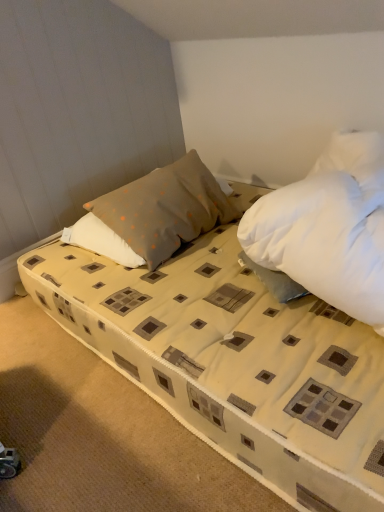
Question: Could gray dotted pillow at center be considered to be inside beige fabric bed at center?

Choices:
 (A) yes
 (B) no

Answer: (B)

Question: Is beige fabric bed at center smaller than gray dotted pillow at center?

Choices:
 (A) yes
 (B) no

Answer: (B)

Question: From the image's perspective, is beige fabric bed at center located beneath gray dotted pillow at center?

Choices:
 (A) yes
 (B) no

Answer: (A)

Question: Does beige fabric bed at center lie in front of gray dotted pillow at center?

Choices:
 (A) no
 (B) yes

Answer: (B)

Question: Does beige fabric bed at center have a lesser width compared to gray dotted pillow at center?

Choices:
 (A) yes
 (B) no

Answer: (B)

Question: Is beige fabric bed at center positioned beyond the bounds of gray dotted pillow at center?

Choices:
 (A) yes
 (B) no

Answer: (A)

Question: Can you confirm if gray dotted pillow at center is positioned to the right of beige fabric bed at center?

Choices:
 (A) no
 (B) yes

Answer: (A)

Question: Considering the relative sizes of gray dotted pillow at center and beige fabric bed at center in the image provided, is gray dotted pillow at center bigger than beige fabric bed at center?

Choices:
 (A) yes
 (B) no

Answer: (B)

Question: Considering the relative positions of gray dotted pillow at center and beige fabric bed at center in the image provided, is gray dotted pillow at center in front of beige fabric bed at center?

Choices:
 (A) yes
 (B) no

Answer: (B)

Question: Is gray dotted pillow at center completely or partially outside of beige fabric bed at center?

Choices:
 (A) no
 (B) yes

Answer: (B)

Question: Considering the relative sizes of gray dotted pillow at center and beige fabric bed at center in the image provided, is gray dotted pillow at center wider than beige fabric bed at center?

Choices:
 (A) no
 (B) yes

Answer: (A)

Question: Does gray dotted pillow at center have a smaller size compared to beige fabric bed at center?

Choices:
 (A) yes
 (B) no

Answer: (A)

Question: Considering the positions of gray dotted pillow at center and beige fabric bed at center in the image, is gray dotted pillow at center bigger or smaller than beige fabric bed at center?

Choices:
 (A) small
 (B) big

Answer: (A)